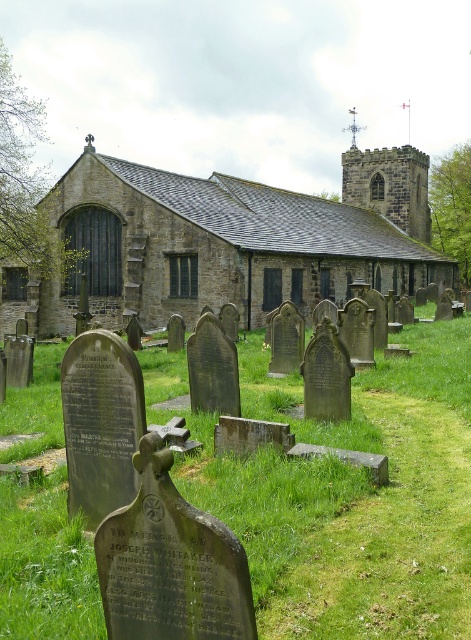
Question: From the image, what is the correct spatial relationship of green grass at center in relation to brown stone church at center?

Choices:
 (A) left
 (B) right

Answer: (A)

Question: Is green grass at center positioned before brown stone church at center?

Choices:
 (A) no
 (B) yes

Answer: (B)

Question: Which object appears farthest from the camera in this image?

Choices:
 (A) green grass at center
 (B) brown stone church at center

Answer: (B)

Question: Is green grass at center to the left of brown stone church at center from the viewer's perspective?

Choices:
 (A) yes
 (B) no

Answer: (A)